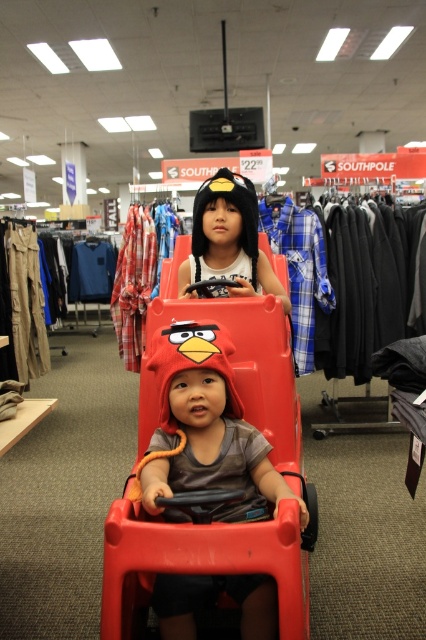
You are a customer in the Southpole store and want to place the matte black hat at center onto the matte plastic toy car at center. Based on their positions, is this possible without moving either object?

The matte plastic toy car at center is located below the matte black hat at center, so placing the hat onto the car would require moving the hat downward or the car upward, which isn not possible without adjusting their positions. Therefore, it is not possible to place the matte black hat at center onto the matte plastic toy car at center without moving either object.

You are a customer in the Southpole store and want to find the matte plastic toy car at center. According to the store layout, where would you look for it?

The matte plastic toy car at center is located at point (x=213, y=464) in the store layout.

You are a customer in the Southpole store and want to place the matte black hat at center on top of the matte plastic toy car at center. Based on their sizes, do you think the hat will fit stably on the car?

The matte plastic toy car at center is taller than the matte black hat at center, so the hat should fit stably on top of the car as it is shorter in height.